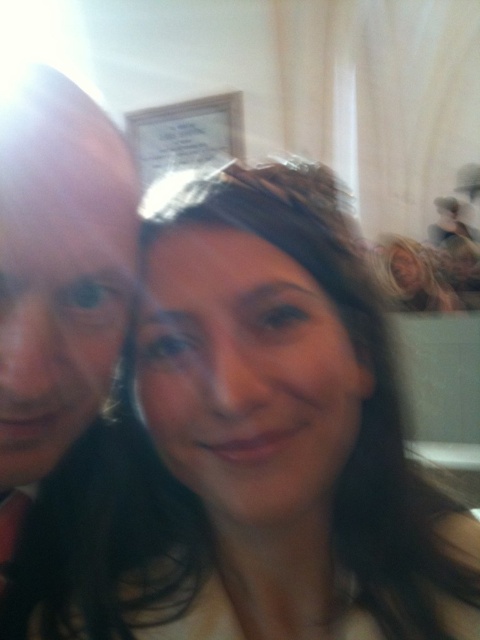
Does point (282, 499) come in front of point (0, 172)?

No, (282, 499) is behind (0, 172).

Who is shorter, dark brown hair at center or matte black hair at left?

dark brown hair at center

Does point (240, 216) come closer to viewer compared to point (56, 268)?

No.

Where is `dark brown hair at center`? This screenshot has width=480, height=640. dark brown hair at center is located at coordinates (262, 440).

Between dark brown hair at center and black silk tie at left, which one appears on the left side from the viewer's perspective?

Positioned to the left is black silk tie at left.

Image resolution: width=480 pixels, height=640 pixels. Describe the element at coordinates (262, 440) in the screenshot. I see `dark brown hair at center` at that location.

Is point (121, 556) positioned after point (14, 516)?

No, (121, 556) is in front of (14, 516).

This screenshot has height=640, width=480. In order to click on dark brown hair at center in this screenshot , I will do `click(262, 440)`.

Looking at this image, which of these two, blonde hair at upper right or black silk tie at left, stands taller?

Standing taller between the two is blonde hair at upper right.

Identify the location of blonde hair at upper right. This screenshot has width=480, height=640. (415, 275).

Is point (414, 244) less distant than point (15, 596)?

That is False.

Where is `blonde hair at upper right`? blonde hair at upper right is located at coordinates (415, 275).